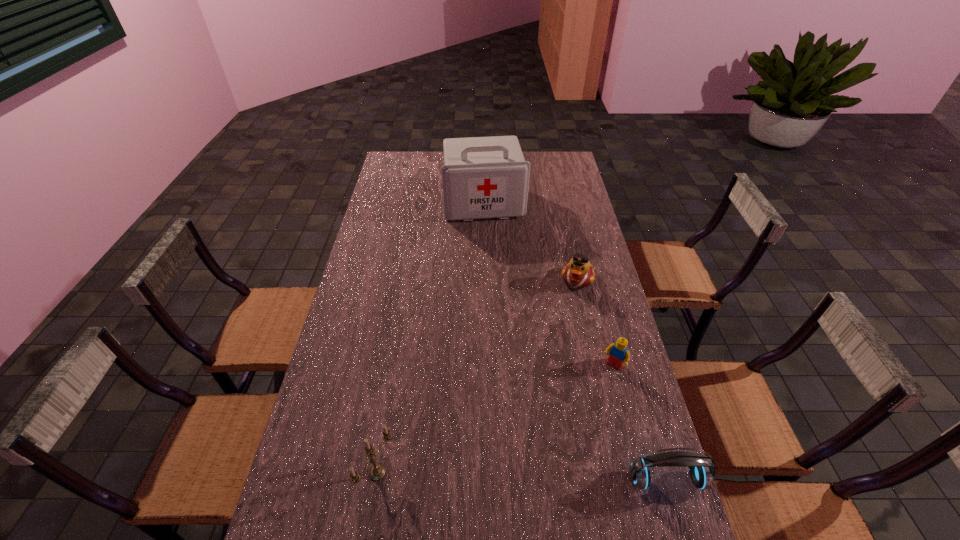
You are a GUI agent. You are given a task and a screenshot of the screen. Output one action in this format:
    pyautogui.click(x=<x>, y=<y>)
    Task: Click on the free space located on the front-facing side of the farthest object
    The width and height of the screenshot is (960, 540).
    Given the screenshot: What is the action you would take?
    pyautogui.click(x=493, y=251)

Locate an element on the screen. The height and width of the screenshot is (540, 960). vacant area located 0.080m on the front-facing side of the farthest object is located at coordinates (491, 235).

Image resolution: width=960 pixels, height=540 pixels. What are the coordinates of `vacant space positioned on the front-facing side of the third nearest object` in the screenshot? It's located at (554, 453).

Find the location of a particular element. vacant space located 0.090m on the front-facing side of the third nearest object is located at coordinates (592, 395).

What are the coordinates of `free space located on the front-facing side of the third nearest object` in the screenshot? It's located at (547, 463).

This screenshot has width=960, height=540. In order to click on vacant space located 0.080m on the face of the fourth nearest object in this screenshot , I will do `click(568, 308)`.

Find the location of `free space located on the face of the fourth nearest object`. free space located on the face of the fourth nearest object is located at coordinates 570,304.

The height and width of the screenshot is (540, 960). What are the coordinates of `vacant space situated on the face of the fourth nearest object` in the screenshot? It's located at (560, 337).

Find the location of a particular element. Image resolution: width=960 pixels, height=540 pixels. object that is at the left edge is located at coordinates (377, 472).

At what (x,y) coordinates should I click in order to perform the action: click on headset present at the right edge. Please return your answer as a coordinate pair (x, y). Looking at the image, I should click on (701, 468).